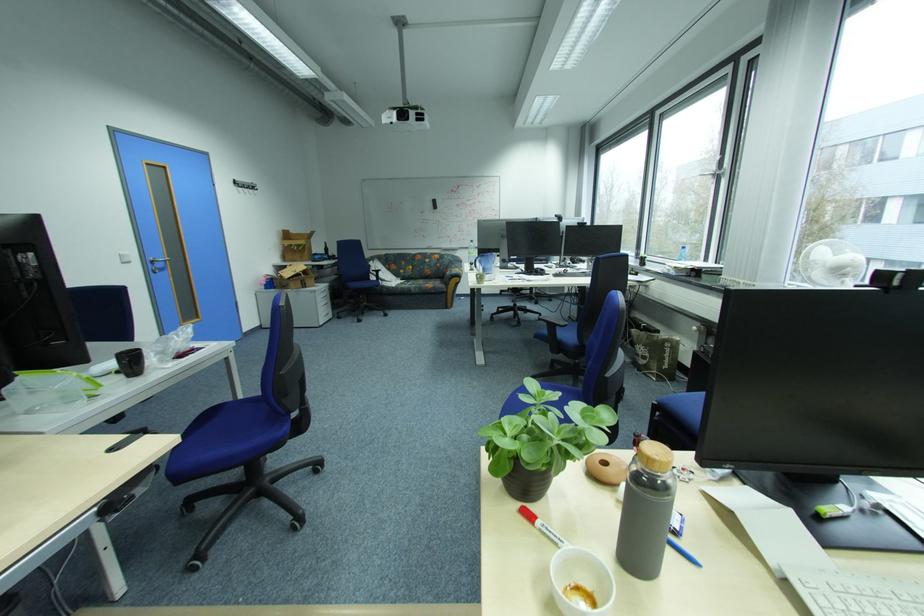
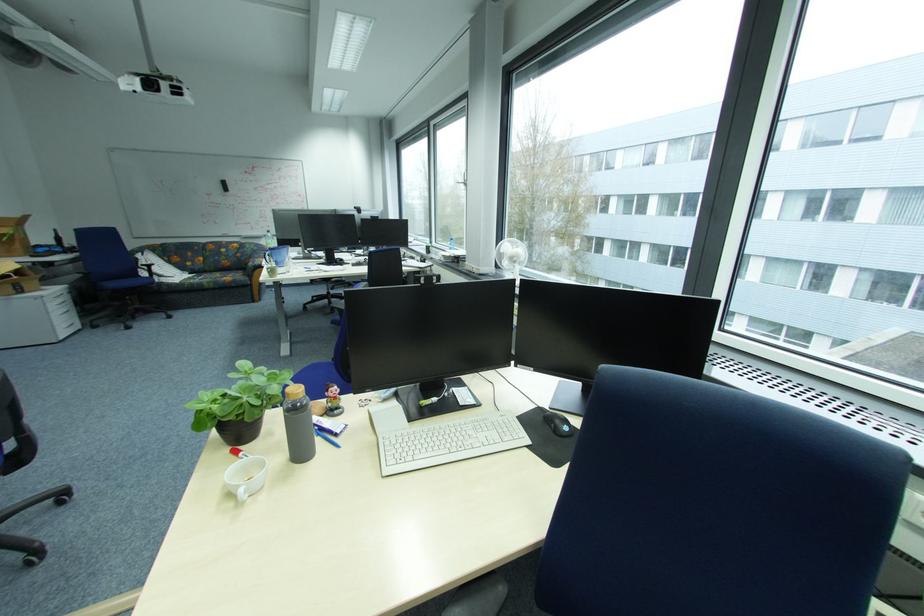
In the second image, find the point that corresponds to pixel 858 270 in the first image.

(524, 259)